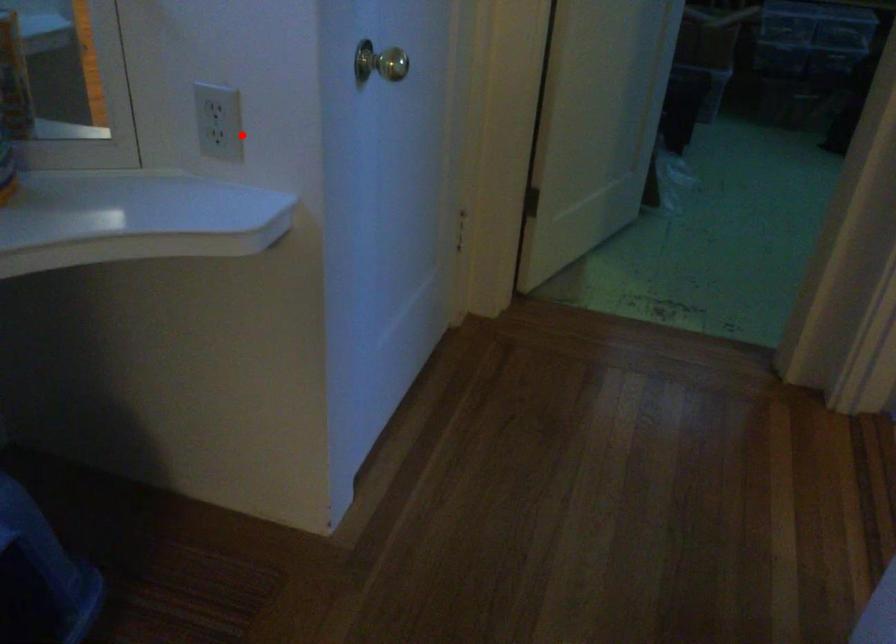
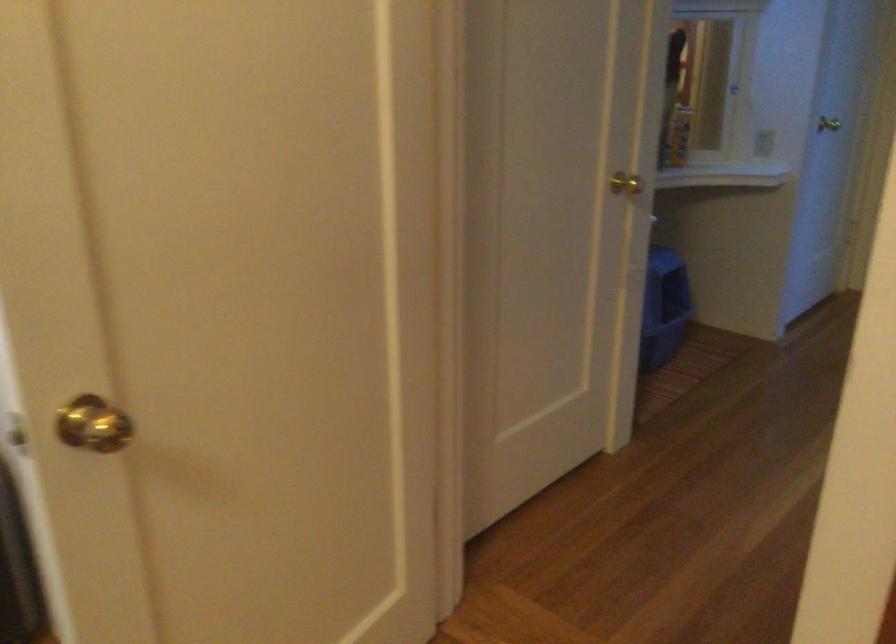
Question: I am providing you with two images of the same scene from different viewpoints. Image1 has a red point marked. In image2, the corresponding 3D location appears at what relative position? Reply with the corresponding letter.

Choices:
 (A) Closer
 (B) Farther

Answer: (B)